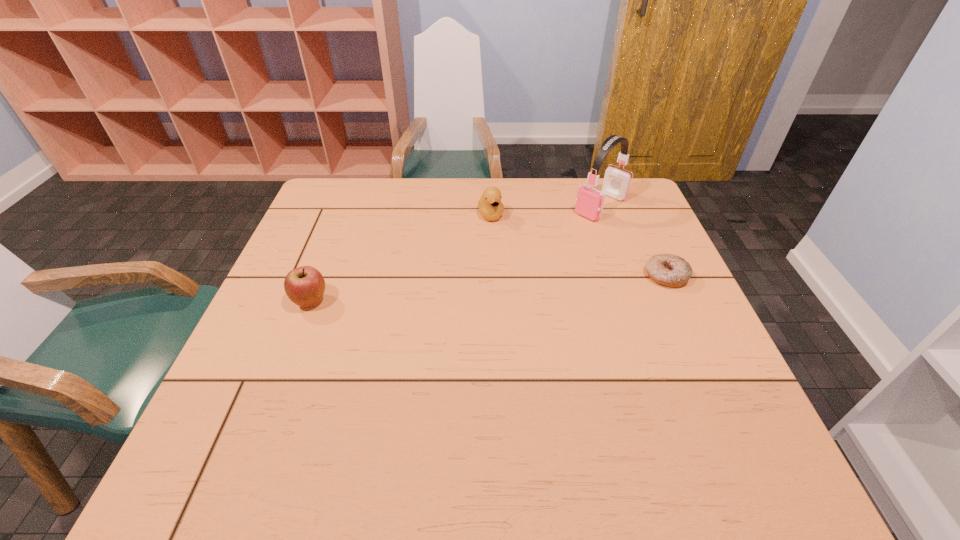
Find the location of `vacant space located 0.350m on the outer surface of the earphone`. vacant space located 0.350m on the outer surface of the earphone is located at coordinates (508, 277).

At what (x,y) coordinates should I click in order to perform the action: click on free region located 0.330m on the outer surface of the earphone. Please return your answer as a coordinate pair (x, y). The width and height of the screenshot is (960, 540). Looking at the image, I should click on (513, 273).

You are a GUI agent. You are given a task and a screenshot of the screen. Output one action in this format:
    pyautogui.click(x=<x>, y=<y>)
    Task: Click on the duckling positioned at the far edge
    
    Given the screenshot: What is the action you would take?
    pyautogui.click(x=491, y=208)

Find the location of `earphone that is at the far edge`. earphone that is at the far edge is located at coordinates (589, 203).

Locate an element on the screen. The height and width of the screenshot is (540, 960). object that is at the left edge is located at coordinates (304, 286).

Identify the location of doughnut that is positioned at the right edge. (670, 270).

The height and width of the screenshot is (540, 960). Find the location of `earphone positioned at the right edge`. earphone positioned at the right edge is located at coordinates (589, 203).

Identify the location of object positioned at the far right corner. (589, 203).

The width and height of the screenshot is (960, 540). In order to click on vacant space at the far edge of the desktop in this screenshot , I will do `click(461, 199)`.

The height and width of the screenshot is (540, 960). I want to click on vacant space at the near edge of the desktop, so click(x=347, y=422).